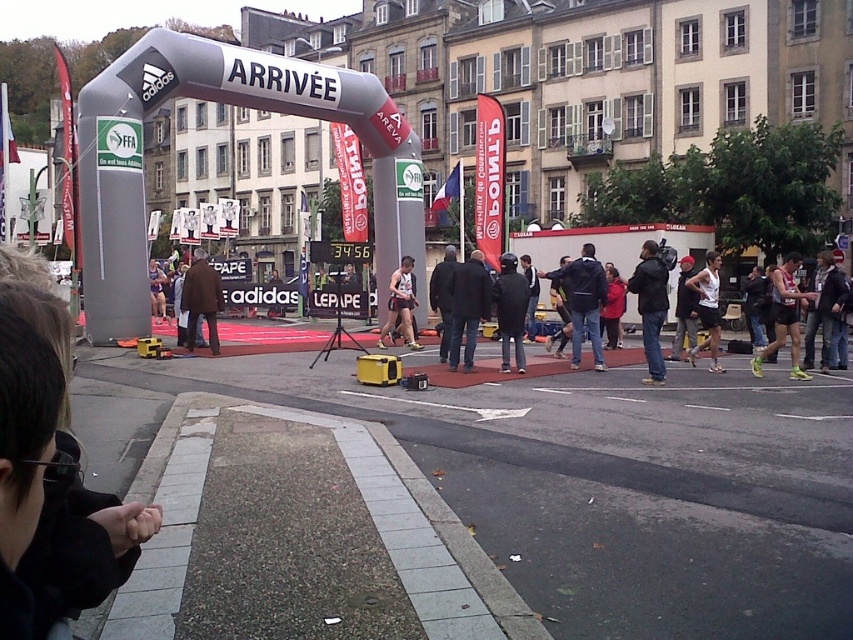
Question: Among these objects, which one is farthest from the camera?

Choices:
 (A) dark gray jacket at center
 (B) brown leather jacket at center

Answer: (B)

Question: From the image, what is the correct spatial relationship of matte black camera at center in relation to matte gray tank top at center?

Choices:
 (A) left
 (B) right

Answer: (A)

Question: Based on their relative distances, which object is nearer to the brown leather jacket at center?

Choices:
 (A) dark blue jacket at center
 (B) matte black camera at center
 (C) matte gray tank top at center

Answer: (A)

Question: Which object appears farthest from the camera in this image?

Choices:
 (A) matte black tank top at center
 (B) dark blue jacket at center

Answer: (A)

Question: Can you confirm if dark gray jacket at center is bigger than white matte tank top at center?

Choices:
 (A) no
 (B) yes

Answer: (B)

Question: Is matte gray tank top at center to the right of brown leather jacket at center from the viewer's perspective?

Choices:
 (A) yes
 (B) no

Answer: (A)